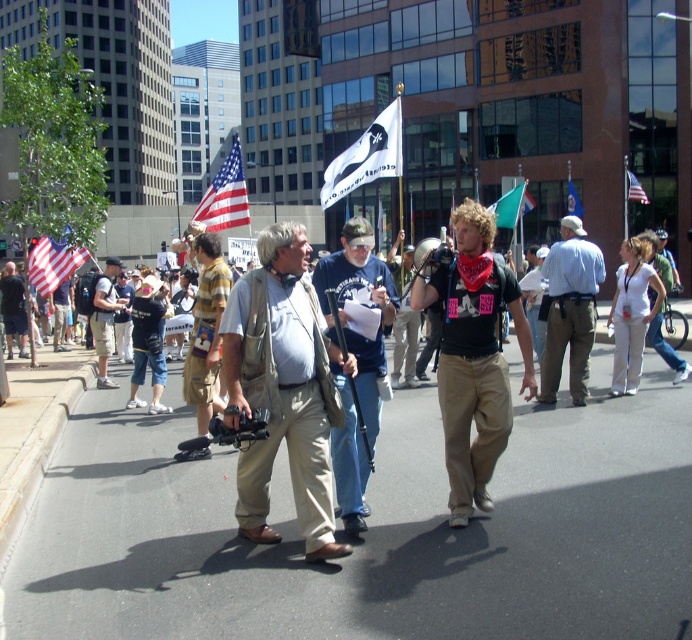
You are a photographer positioned at the scene. You want to capture a photo that includes both the khaki pants at center and the white fabric flag at center. What is the minimum distance you need to move backward to ensure both objects are in frame?

The khaki pants at center and white fabric flag at center are 20.09 feet apart from each other. To include both in the frame, the photographer should move backward until the camera can accommodate the 20.09 feet distance between them.

You are a photographer trying to capture the green fabric flag at center in your shot. The camera you are using has a limited field of view. Given that the flag is at point coordinates (511, 205), can you determine if the flag will be visible in your photo if you frame the shot to include the man with the camera and microphone?

The green fabric flag at center is located at point coordinates (511, 205). Since the photographer is focusing on the man with the camera and microphone, the flag at those coordinates would likely be within the frame if the shot includes the central area where the flag is positioned.